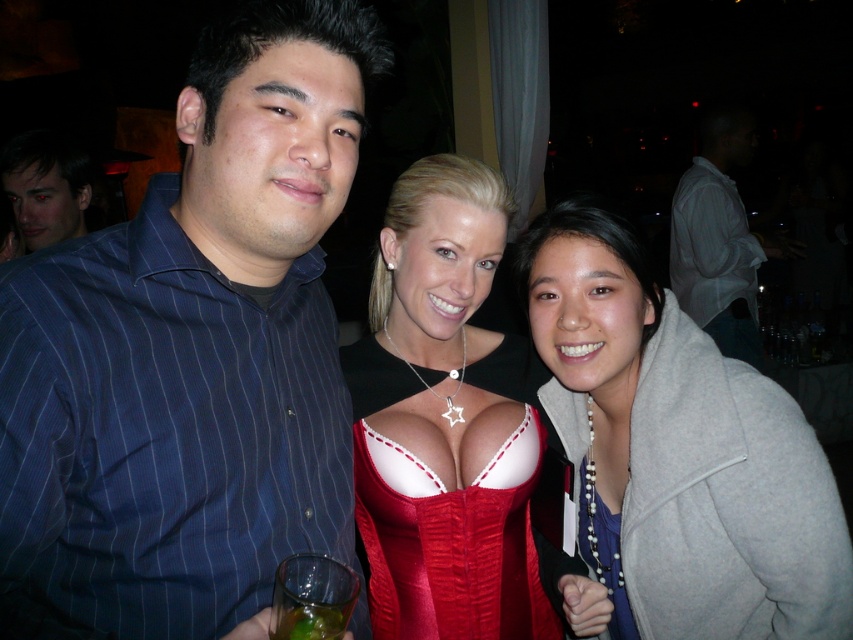
Question: Which point appears farthest from the camera in this image?

Choices:
 (A) (48, 387)
 (B) (691, 428)
 (C) (292, 621)

Answer: (B)

Question: Which point is farther from the camera taking this photo?

Choices:
 (A) (317, 630)
 (B) (73, 180)
 (C) (339, 605)
 (D) (717, 618)

Answer: (B)

Question: Which point is farther from the camera taking this photo?

Choices:
 (A) (688, 172)
 (B) (285, 600)
 (C) (219, 221)

Answer: (A)

Question: Can you confirm if dark blue pinstripe shirt at left is thinner than red satin corset at center?

Choices:
 (A) yes
 (B) no

Answer: (B)

Question: Can you confirm if red satin corset at center is thinner than green translucent liquid at lower left?

Choices:
 (A) yes
 (B) no

Answer: (B)

Question: Does gray woolen coat at right lie in front of smooth skin face at upper left?

Choices:
 (A) yes
 (B) no

Answer: (A)